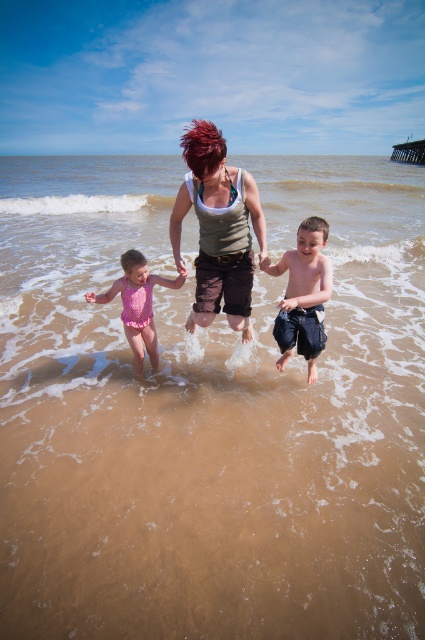
You are a photographer trying to capture the woman and children in the scene. You want to ensure that both the blue denim shorts at center and the pink matte swimsuit at center are clearly visible in the photo. Which object should you focus on first to ensure depth of field captures both?

The blue denim shorts at center is taller than the pink matte swimsuit at center. To ensure both are in focus, focus on the blue denim shorts at center first since it is farther away, allowing the depth of field to cover the closer pink matte swimsuit at center.

You are a photographer standing at the beach and want to take a photo of the matte gray tank top at center and the pink matte swimsuit at center. Which one will appear larger in the photo?

The matte gray tank top at center will appear larger in the photo because it is closer to the viewer than the pink matte swimsuit at center.